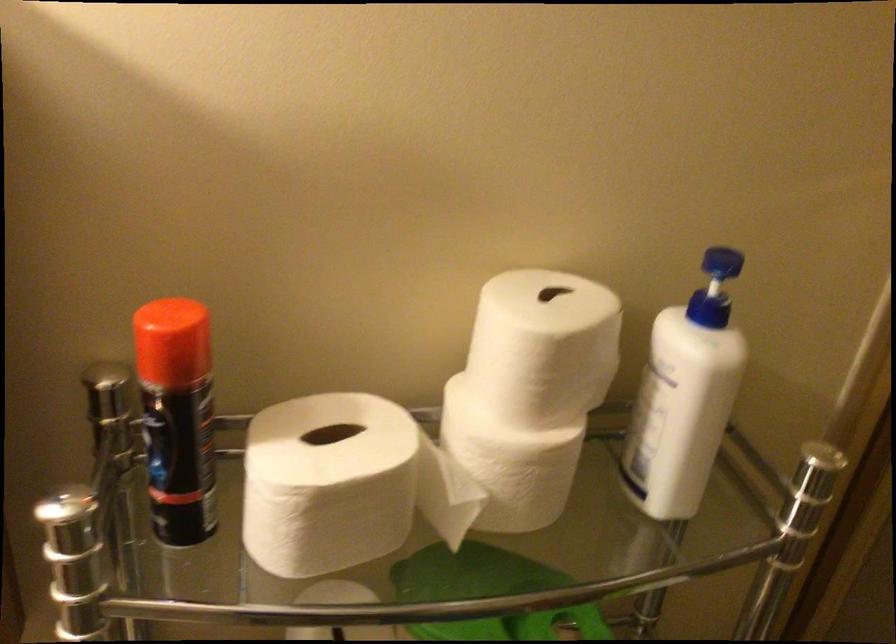
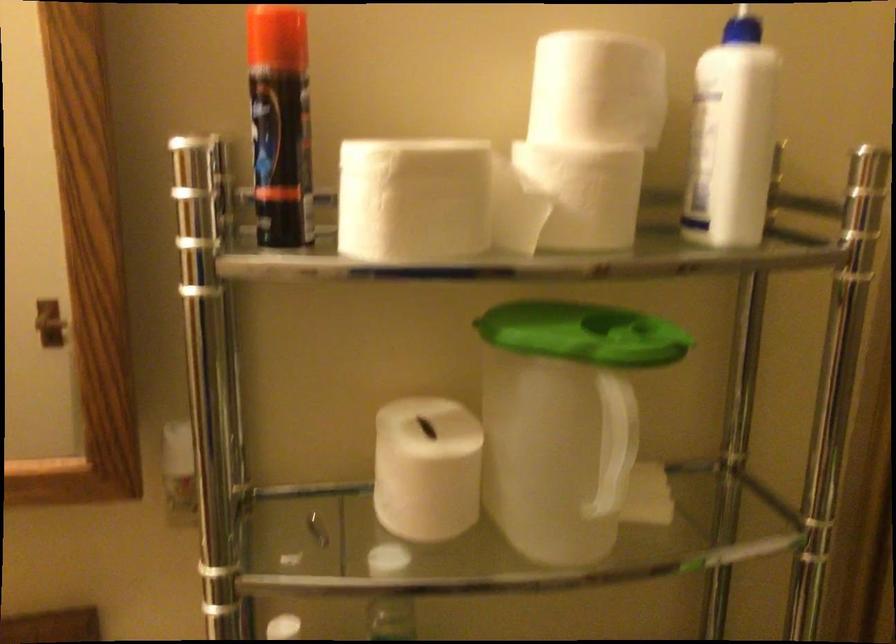
Locate, in the second image, the point that corresponds to [688,412] in the first image.

(731, 137)